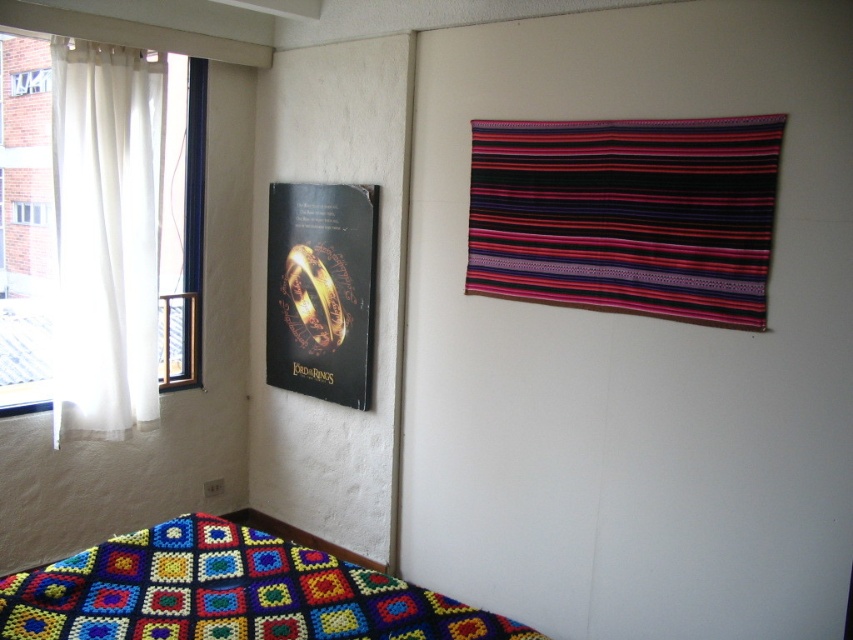
Question: Is white sheer curtain at left bigger than black paper poster at left?

Choices:
 (A) yes
 (B) no

Answer: (B)

Question: Where is multicolored woven tapestry at upper right located in relation to multicolored crocheted quilt at lower left in the image?

Choices:
 (A) below
 (B) above

Answer: (B)

Question: Is multicolored crocheted quilt at lower left closer to the viewer compared to white sheer curtain at left?

Choices:
 (A) yes
 (B) no

Answer: (A)

Question: Which point is farther to the camera?

Choices:
 (A) white sheer curtain at left
 (B) black paper poster at left
 (C) multicolored woven tapestry at upper right

Answer: (B)

Question: Which object appears closest to the camera in this image?

Choices:
 (A) multicolored crocheted quilt at lower left
 (B) multicolored woven tapestry at upper right
 (C) white sheer curtain at left
 (D) black paper poster at left

Answer: (A)

Question: Which is nearer to the white sheer curtain at left?

Choices:
 (A) multicolored crocheted quilt at lower left
 (B) multicolored woven tapestry at upper right
 (C) black paper poster at left

Answer: (C)